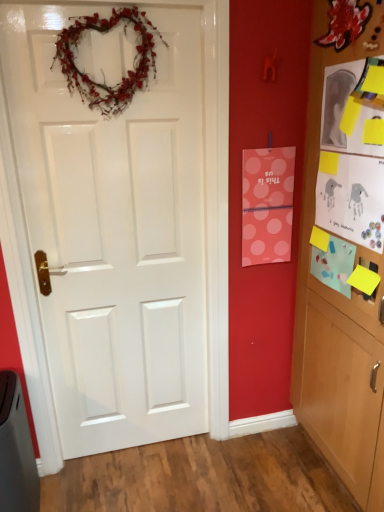
You are a GUI agent. You are given a task and a screenshot of the screen. Output one action in this format:
    pyautogui.click(x=<x>, y=<y>)
    Task: Click on the white glossy door at center
    
    Given the screenshot: What is the action you would take?
    pyautogui.click(x=115, y=231)

This screenshot has height=512, width=384. What do you see at coordinates (351, 198) in the screenshot?
I see `white paper postcard at upper right, which is the 1th postcard from right to left` at bounding box center [351, 198].

Measure the distance between matte blue paper at right, which ranks as the second postcard in left-to-right order, and camera.

matte blue paper at right, which ranks as the second postcard in left-to-right order, and camera are 4.93 feet apart.

At what (x,y) coordinates should I click in order to perform the action: click on white glossy door at center. Please return your answer as a coordinate pair (x, y). This screenshot has height=512, width=384. Looking at the image, I should click on (115, 231).

Is matte blue paper at right, which is counted as the second postcard, starting from the right, located within pink polka dot paper at upper right, the 1th postcard from the left?

Definitely not — matte blue paper at right, which is counted as the second postcard, starting from the right, is not inside pink polka dot paper at upper right, the 1th postcard from the left.

Between point (280, 250) and point (340, 279), which one is positioned in front?

The point (340, 279) is more forward.

This screenshot has height=512, width=384. Identify the location of postcard on the left of the matte blue paper at right, which is counted as the second postcard, starting from the right. (267, 205).

Considering the relative sizes of pink polka dot paper at upper right, placed as the 3th postcard when sorted from right to left, and matte blue paper at right, which is counted as the second postcard, starting from the right, in the image provided, is pink polka dot paper at upper right, placed as the 3th postcard when sorted from right to left, shorter than matte blue paper at right, which is counted as the second postcard, starting from the right,?

Incorrect, the height of pink polka dot paper at upper right, placed as the 3th postcard when sorted from right to left, does not fall short of that of matte blue paper at right, which is counted as the second postcard, starting from the right.

The height and width of the screenshot is (512, 384). Identify the location of cabinetry below the matte blue paper at right, which is counted as the second postcard, starting from the right (from the image's perspective). (345, 247).

Which object is closer to the camera, wooden cabinet at right or matte blue paper at right, which ranks as the second postcard in left-to-right order?

wooden cabinet at right is in front.

From the image's perspective, is wooden cabinet at right above or below matte blue paper at right, which is counted as the second postcard, starting from the right?

wooden cabinet at right is situated lower than matte blue paper at right, which is counted as the second postcard, starting from the right, in the image.

What's the angular difference between wooden cabinet at right and matte blue paper at right, which is counted as the second postcard, starting from the right,'s facing directions?

wooden cabinet at right and matte blue paper at right, which is counted as the second postcard, starting from the right, are facing 0.483 degrees away from each other.

Can you confirm if white paper postcard at upper right, which is the 1th postcard from right to left, is smaller than matte blue paper at right, which is counted as the second postcard, starting from the right?

No, white paper postcard at upper right, which is the 1th postcard from right to left, is not smaller than matte blue paper at right, which is counted as the second postcard, starting from the right.

Between white paper postcard at upper right, the third postcard when ordered from left to right, and matte blue paper at right, which ranks as the second postcard in left-to-right order, which one has larger width?

With larger width is matte blue paper at right, which ranks as the second postcard in left-to-right order.

Does white paper postcard at upper right, the third postcard when ordered from left to right, come behind matte blue paper at right, which ranks as the second postcard in left-to-right order?

No, white paper postcard at upper right, the third postcard when ordered from left to right, is in front of matte blue paper at right, which ranks as the second postcard in left-to-right order.

Is white paper postcard at upper right, which is the 1th postcard from right to left, not close to matte blue paper at right, which ranks as the second postcard in left-to-right order?

white paper postcard at upper right, which is the 1th postcard from right to left, is actually quite close to matte blue paper at right, which ranks as the second postcard in left-to-right order.

In the image, is matte blue paper at right, which ranks as the second postcard in left-to-right order, on the left side or the right side of white paper postcard at upper right, the third postcard when ordered from left to right?

Clearly, matte blue paper at right, which ranks as the second postcard in left-to-right order, is on the left of white paper postcard at upper right, the third postcard when ordered from left to right, in the image.

Could white paper postcard at upper right, which is the 1th postcard from right to left, be considered to be inside matte blue paper at right, which is counted as the second postcard, starting from the right?

No, white paper postcard at upper right, which is the 1th postcard from right to left, is not inside matte blue paper at right, which is counted as the second postcard, starting from the right.

Is matte blue paper at right, which ranks as the second postcard in left-to-right order, positioned with its back to white paper postcard at upper right, the third postcard when ordered from left to right?

matte blue paper at right, which ranks as the second postcard in left-to-right order, does not have its back to white paper postcard at upper right, the third postcard when ordered from left to right.

From the image's perspective, is wooden cabinet at right beneath white glossy door at center?

Actually, wooden cabinet at right appears above white glossy door at center in the image.

Could white glossy door at center be considered to be inside wooden cabinet at right?

No, white glossy door at center is not inside wooden cabinet at right.

Based on their sizes in the image, would you say wooden cabinet at right is bigger or smaller than white glossy door at center?

wooden cabinet at right is bigger than white glossy door at center.

Does wooden cabinet at right turn towards white glossy door at center?

Yes, wooden cabinet at right is turned towards white glossy door at center.

Is white glossy door at center taller or shorter than wooden cabinet at right?

Clearly, white glossy door at center is shorter compared to wooden cabinet at right.

Is point (196, 156) closer or farther from the camera than point (349, 425)?

Point (196, 156) appears to be farther away from the viewer than point (349, 425).

From the image's perspective, which one is positioned lower, white glossy door at center or wooden cabinet at right?

white glossy door at center is shown below in the image.

From the picture: Considering the sizes of white glossy door at center and wooden cabinet at right in the image, is white glossy door at center bigger or smaller than wooden cabinet at right?

In the image, white glossy door at center appears to be smaller than wooden cabinet at right.

Considering the positions of objects pink polka dot paper at upper right, placed as the 3th postcard when sorted from right to left, and natural twig heart wreath at upper center in the image provided, who is behind, pink polka dot paper at upper right, placed as the 3th postcard when sorted from right to left, or natural twig heart wreath at upper center?

pink polka dot paper at upper right, placed as the 3th postcard when sorted from right to left, is more distant.

Does point (269, 214) come behind point (154, 74)?

Yes, point (269, 214) is behind point (154, 74).

Considering the positions of objects pink polka dot paper at upper right, the 1th postcard from the left, and natural twig heart wreath at upper center in the image provided, who is more to the right, pink polka dot paper at upper right, the 1th postcard from the left, or natural twig heart wreath at upper center?

Positioned to the right is pink polka dot paper at upper right, the 1th postcard from the left.

I want to click on postcard that is the 1st one when counting forward from the pink polka dot paper at upper right, the 1th postcard from the left, so click(x=333, y=264).

From a real-world perspective, starting from the wooden cabinet at right, which postcard is the 1st one vertically above it? Please provide its 2D coordinates.

[(333, 264)]

From the image, which object appears to be farther from pink polka dot paper at upper right, placed as the 3th postcard when sorted from right to left, white paper postcard at upper right, the third postcard when ordered from left to right, or matte blue paper at right, which ranks as the second postcard in left-to-right order?

The object further to pink polka dot paper at upper right, placed as the 3th postcard when sorted from right to left, is white paper postcard at upper right, the third postcard when ordered from left to right.

Which object lies nearer to the anchor point white paper postcard at upper right, which is the 1th postcard from right to left, wooden cabinet at right or white glossy door at center?

Among the two, wooden cabinet at right is located nearer to white paper postcard at upper right, which is the 1th postcard from right to left.

Estimate the real-world distances between objects in this image. Which object is further from white glossy door at center, wooden cabinet at right or pink polka dot paper at upper right, the 1th postcard from the left?

wooden cabinet at right is further to white glossy door at center.

Based on their spatial positions, is matte blue paper at right, which ranks as the second postcard in left-to-right order, or white glossy door at center closer to natural twig heart wreath at upper center?

Among the two, white glossy door at center is located nearer to natural twig heart wreath at upper center.

Based on their spatial positions, is pink polka dot paper at upper right, placed as the 3th postcard when sorted from right to left, or white paper postcard at upper right, which is the 1th postcard from right to left, further from wooden cabinet at right?

The object further to wooden cabinet at right is pink polka dot paper at upper right, placed as the 3th postcard when sorted from right to left.

Which object lies nearer to the anchor point white glossy door at center, pink polka dot paper at upper right, the 1th postcard from the left, or natural twig heart wreath at upper center?

natural twig heart wreath at upper center lies closer to white glossy door at center than the other object.

Which object lies nearer to the anchor point matte blue paper at right, which ranks as the second postcard in left-to-right order, white paper postcard at upper right, which is the 1th postcard from right to left, or wooden cabinet at right?

Among the two, white paper postcard at upper right, which is the 1th postcard from right to left, is located nearer to matte blue paper at right, which ranks as the second postcard in left-to-right order.

Considering their positions, is wooden cabinet at right positioned further to natural twig heart wreath at upper center than pink polka dot paper at upper right, placed as the 3th postcard when sorted from right to left?

Among the two, wooden cabinet at right is located further to natural twig heart wreath at upper center.

Identify the location of christmas decoration between white glossy door at center and white paper postcard at upper right, which is the 1th postcard from right to left. The height and width of the screenshot is (512, 384). (101, 69).

At what (x,y) coordinates should I click in order to perform the action: click on christmas decoration between white glossy door at center and wooden cabinet at right in the horizontal direction. Please return your answer as a coordinate pair (x, y). Looking at the image, I should click on (101, 69).

Where is `postcard between white glossy door at center and matte blue paper at right, which is counted as the second postcard, starting from the right, from left to right`? This screenshot has width=384, height=512. postcard between white glossy door at center and matte blue paper at right, which is counted as the second postcard, starting from the right, from left to right is located at coordinates (267, 205).

The width and height of the screenshot is (384, 512). What are the coordinates of `postcard located between natural twig heart wreath at upper center and matte blue paper at right, which is counted as the second postcard, starting from the right, in the left-right direction` in the screenshot? It's located at (267, 205).